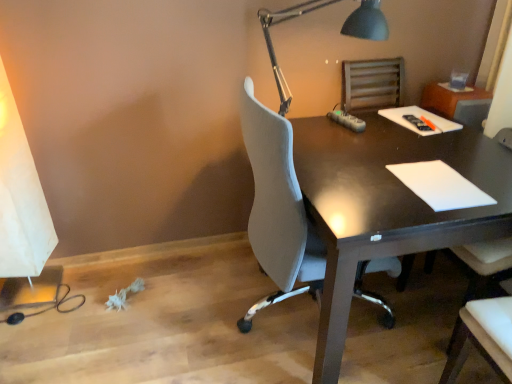
Find the location of `spots to the right of white matte notepad at right`. spots to the right of white matte notepad at right is located at coordinates (490, 171).